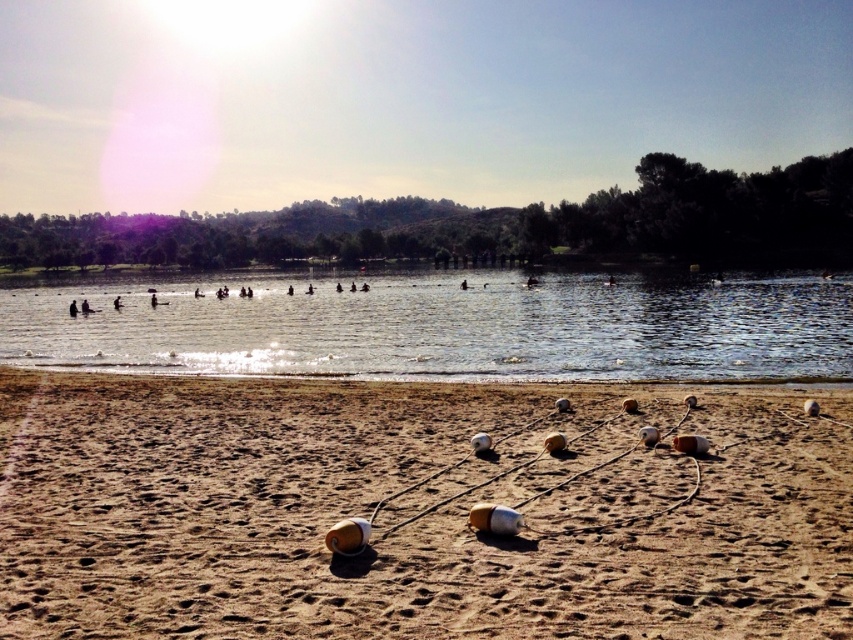
You are standing on the brown sandy beach at lower center and want to reach the clear water at center. Which direction should you move to get there?

You should move to the left because the brown sandy beach at lower center is positioned on the right side of clear water at center, so moving left will take you towards the water.

You are standing on the brown sandy beach at lower center and want to reach the clear water at center. Which direction should you move to get to the water?

Since the brown sandy beach at lower center has a lesser height compared to the clear water at center, you should move upward to reach the clear water at center.